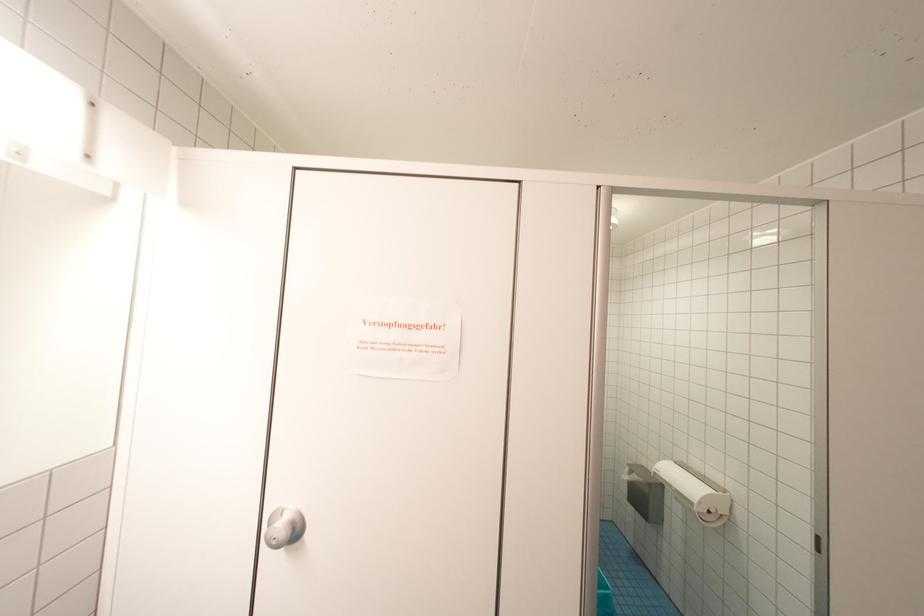
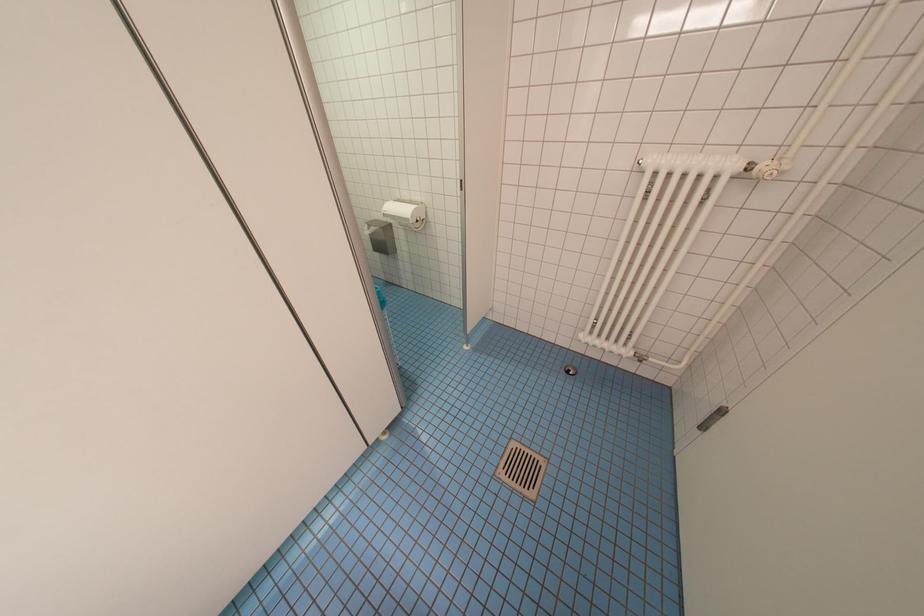
Based on the photo, the images are taken continuously from a first-person perspective. In which direction is your viewpoint rotating?

The rotation direction of the camera is right-down.